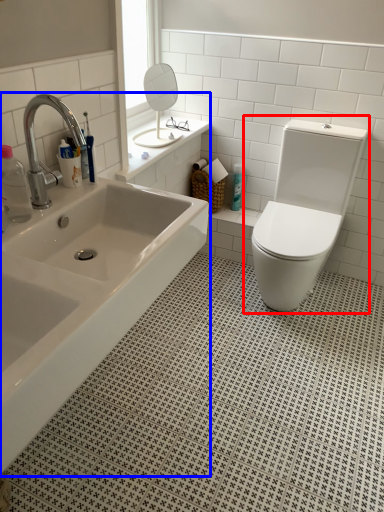
Question: Which object is further to the camera taking this photo, toilet (highlighted by a red box) or bathtub (highlighted by a blue box)?

Choices:
 (A) toilet
 (B) bathtub

Answer: (A)